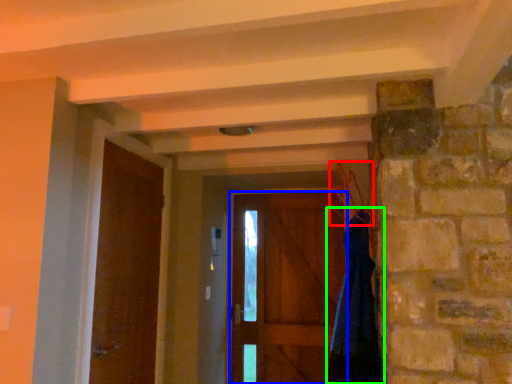
Question: Based on their relative distances, which object is farther from hanger (highlighted by a red box)? Choose from door (highlighted by a blue box) and dress (highlighted by a green box).

Choices:
 (A) door
 (B) dress

Answer: (A)